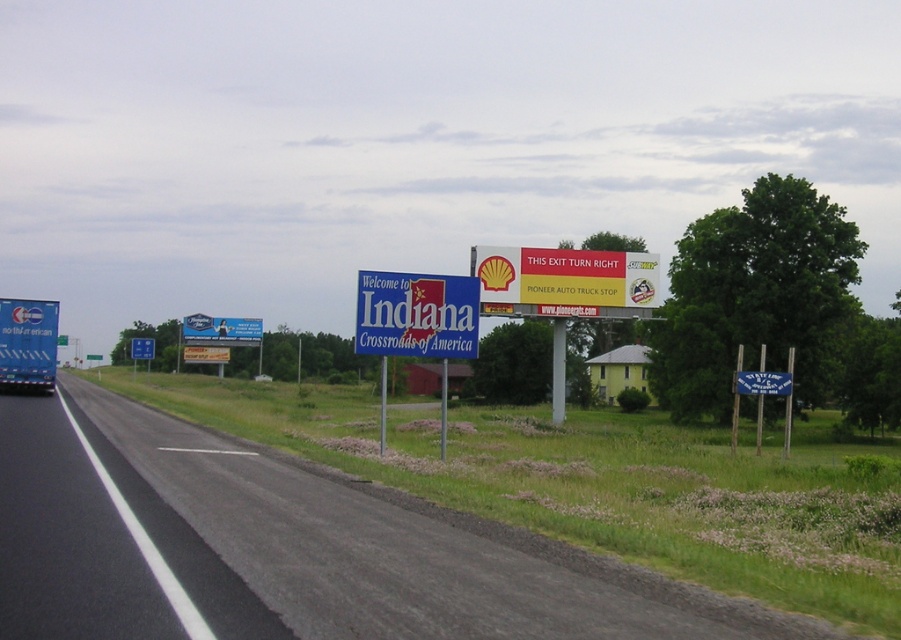
Question: Does black asphalt road at center appear over blue plastic sign at center?

Choices:
 (A) yes
 (B) no

Answer: (B)

Question: Can you confirm if black asphalt road at center is positioned to the right of blue plastic sign at center?

Choices:
 (A) yes
 (B) no

Answer: (B)

Question: Which point is closer to the camera taking this photo?

Choices:
 (A) (372, 352)
 (B) (706, 634)

Answer: (B)

Question: Which point appears closest to the camera in this image?

Choices:
 (A) (370, 516)
 (B) (451, 314)

Answer: (A)

Question: Can you confirm if black asphalt road at center is bigger than blue plastic sign at center?

Choices:
 (A) no
 (B) yes

Answer: (B)